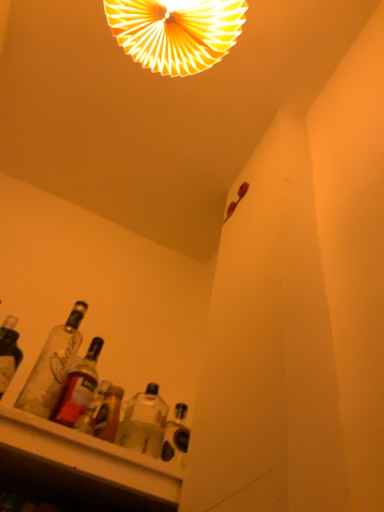
Question: Considering the positions of point (24, 386) and point (71, 417), is point (24, 386) closer or farther from the camera than point (71, 417)?

Choices:
 (A) farther
 (B) closer

Answer: (B)

Question: Would you say clear glass bottles at lower left, the second bottle when ordered from right to left, is to the left or to the right of translucent glass bottle at lower left, which is the second bottle in left-to-right order, in the picture?

Choices:
 (A) left
 (B) right

Answer: (A)

Question: Based on their relative distances, which object is nearer to the clear glass bottles at lower left, the second bottle when ordered from right to left?

Choices:
 (A) translucent glass bottle at lower left, which is the second bottle in left-to-right order
 (B) white paper fan at upper center

Answer: (A)

Question: Based on their relative distances, which object is nearer to the translucent glass bottle at lower left, which is counted as the 1th bottle, starting from the right?

Choices:
 (A) clear glass bottles at lower left, the second bottle when ordered from right to left
 (B) white paper fan at upper center

Answer: (A)